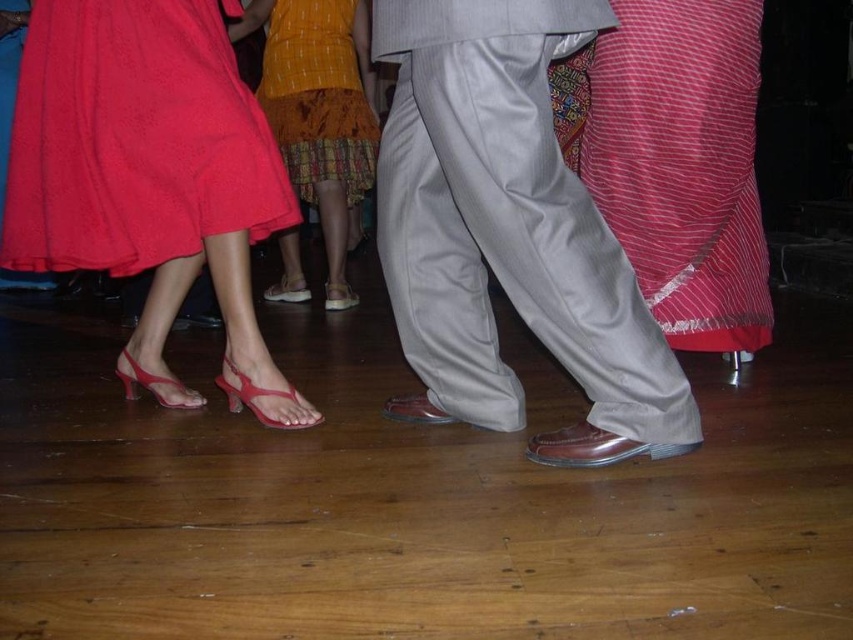
Question: Which point is farther to the camera?

Choices:
 (A) matte leather shoes at center
 (B) yellow printed fabric at center
 (C) light gray trousers at center

Answer: (B)

Question: Which of the following is the closest to the observer?

Choices:
 (A) matte leather shoes at center
 (B) yellow printed fabric at center
 (C) light gray trousers at center

Answer: (C)

Question: Is red striped fabric at right above yellow printed fabric at center?

Choices:
 (A) no
 (B) yes

Answer: (A)

Question: Does light gray trousers at center have a greater width compared to matte red skirt at lower left?

Choices:
 (A) yes
 (B) no

Answer: (B)

Question: Which object is positioned closest to the matte red skirt at lower left?

Choices:
 (A) light gray trousers at center
 (B) yellow printed fabric at center
 (C) matte leather shoes at center
 (D) red striped fabric at right

Answer: (A)

Question: Can you confirm if light gray trousers at center is positioned to the right of matte red skirt at lower left?

Choices:
 (A) no
 (B) yes

Answer: (B)